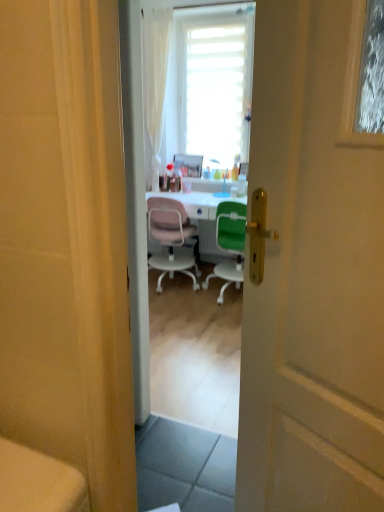
Question: Based on their positions, is white matte door at center located to the left or right of wooden picture frame at center?

Choices:
 (A) right
 (B) left

Answer: (A)

Question: From a real-world perspective, relative to wooden picture frame at center, is white matte door at center vertically above or below?

Choices:
 (A) above
 (B) below

Answer: (B)

Question: Estimate the real-world distances between objects in this image. Which object is closer to the pink plastic chair at center, which ranks as the second chair in right-to-left order?

Choices:
 (A) white glossy desk at center
 (B) wooden picture frame at center
 (C) green plastic chair at center, the first chair positioned from the right
 (D) white matte door at center

Answer: (A)

Question: Which of these objects is positioned closest to the white glossy desk at center?

Choices:
 (A) wooden picture frame at center
 (B) green plastic chair at center, the first chair positioned from the right
 (C) pink plastic chair at center, positioned as the first chair in left-to-right order
 (D) white matte door at center

Answer: (B)